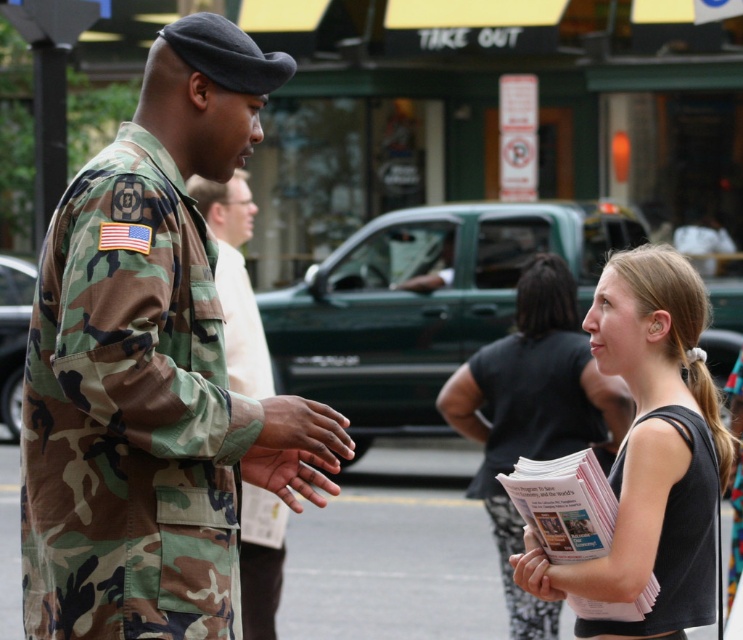
You are a photographer taking a picture of the scene. You want to focus on the black tank top at right and the black matte uniform at lower right. Which one should you adjust your camera to focus on first if you want to capture both clearly?

The black tank top at right is above the black matte uniform at lower right, so you should focus on the black tank top at right first to ensure both are in clear focus.

You are a photographer trying to capture the civilian in the scene. Since the civilian is holding the smooth white paper at lower center, where should you focus your camera to ensure the black tank top at center is visible in the photo?

The black tank top at center is positioned over the smooth white paper at lower center, so focusing on the area where the black tank top is located will ensure both the tank top and the paper are visible in the photo.